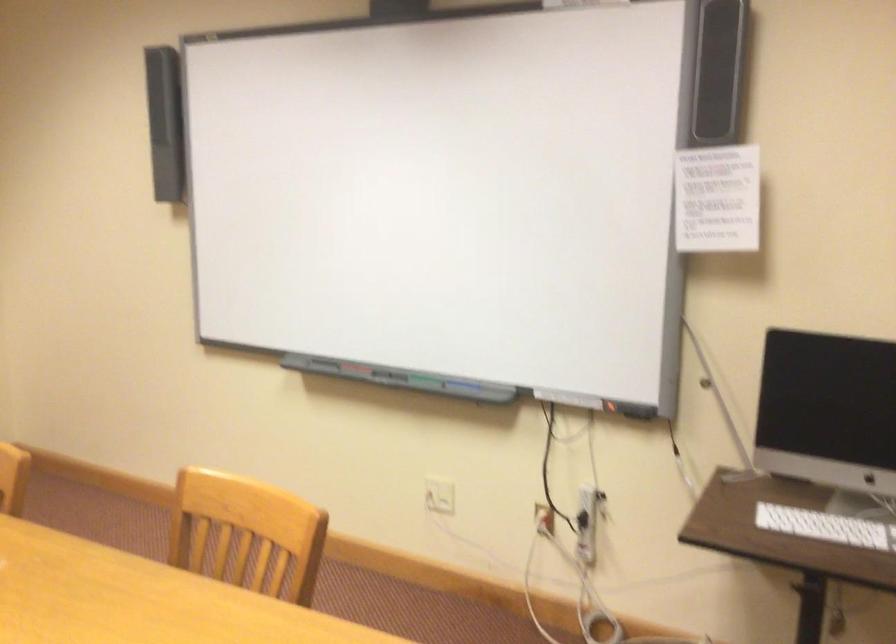
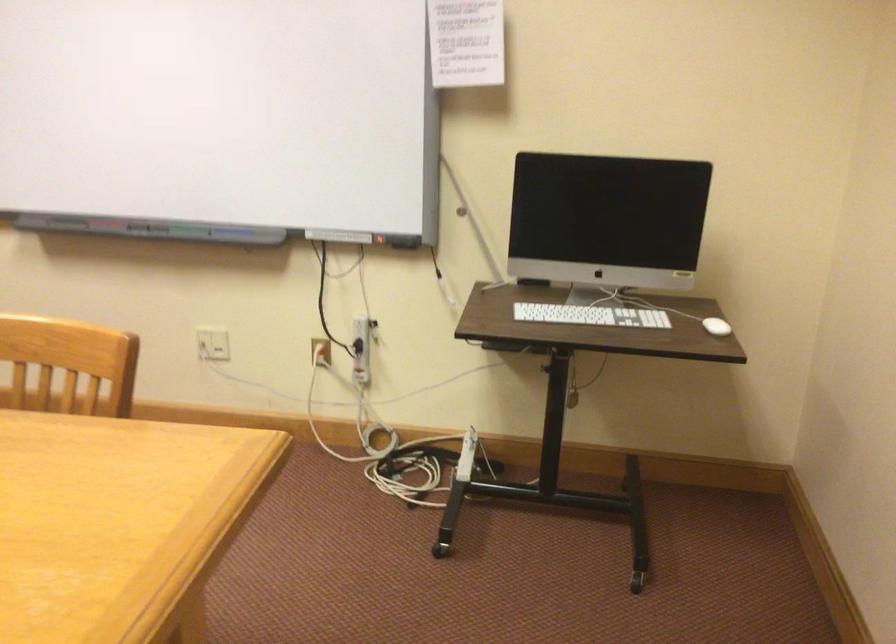
Locate, in the second image, the point that corresponds to [547,518] in the first image.

(321, 351)